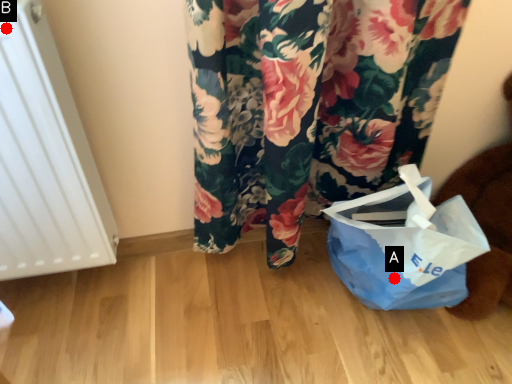
Question: Two points are circled on the image, labeled by A and B beside each circle. Which point appears farthest from the camera in this image?

Choices:
 (A) A is further
 (B) B is further

Answer: (A)